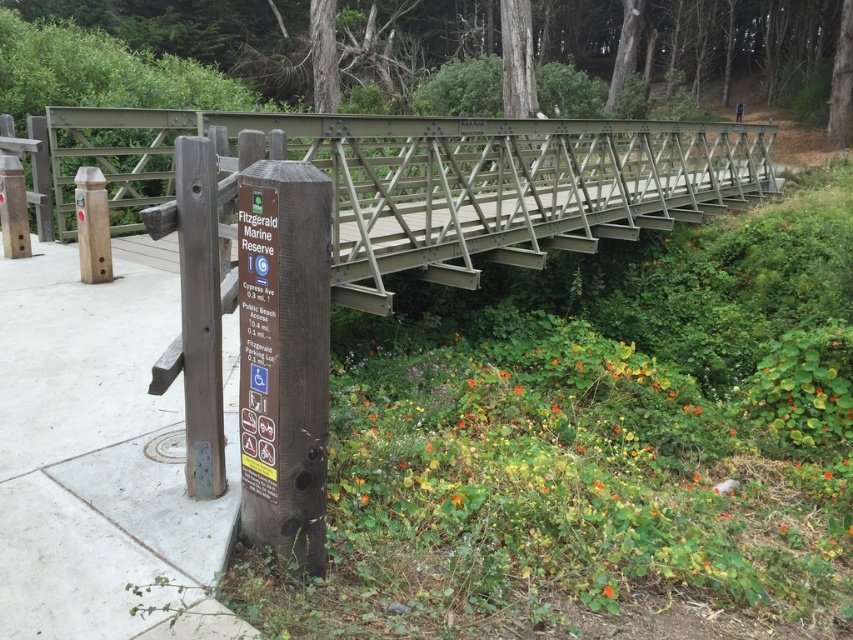
You are standing at the signpost labeled Fitzgerald Marine Reserve. You need to cross the metallic gray bridge at upper center to reach the Public Beach Access. Which direction should you head from the signpost to approach the bridge?

The metallic gray bridge at upper center is located at coordinates point (438, 182), so you should head towards the upper center direction from the signpost to approach the bridge.

You are a hiker who wants to take a photo of the Fitzgerald Marine Reserve sign. You are currently standing on the metallic gray bridge at upper center. Can you see the wooden signpost at lower left from your current position?

The metallic gray bridge at upper center is above the wooden signpost at lower left, so yes, you can see the wooden signpost at lower left from the bridge since it is positioned below the bridge.